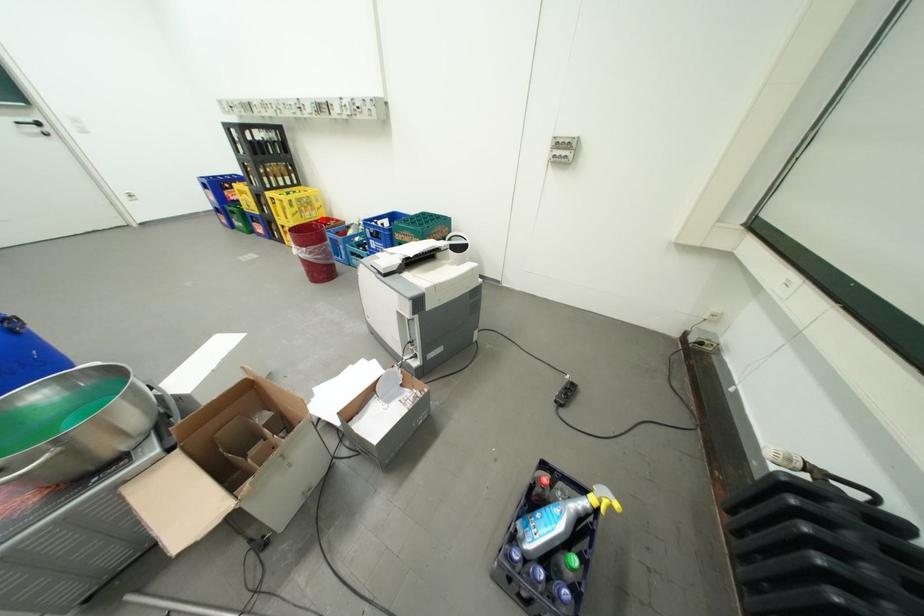
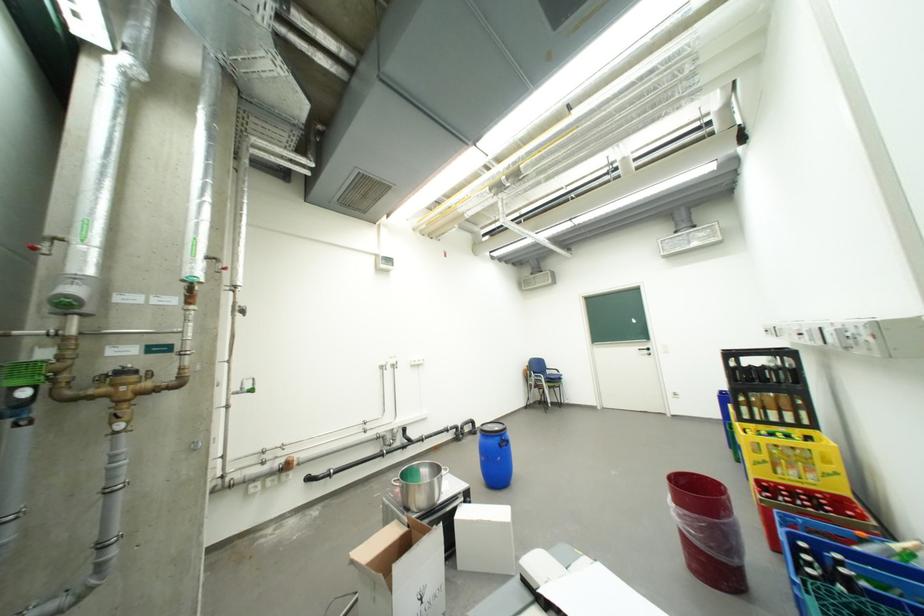
Question: I am providing you with two images of the same scene from different viewpoints. In image1, a red point is highlighted. Considering the same 3D point in image2, which of the following is correct?

Choices:
 (A) It is closer
 (B) It is farther

Answer: (B)